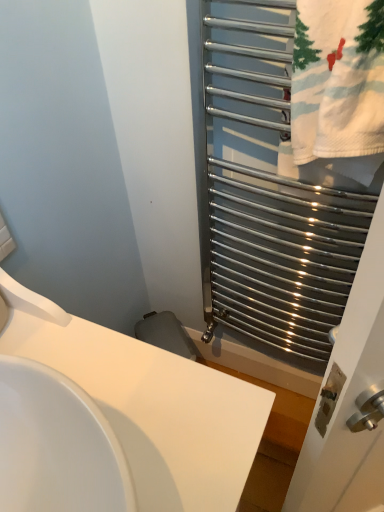
Question: Is polished metal towel rack at right outside white cotton towel at right?

Choices:
 (A) yes
 (B) no

Answer: (A)

Question: Does polished metal towel rack at right have a lesser width compared to white cotton towel at right?

Choices:
 (A) yes
 (B) no

Answer: (B)

Question: Can you confirm if polished metal towel rack at right is bigger than white cotton towel at right?

Choices:
 (A) no
 (B) yes

Answer: (B)

Question: Is polished metal towel rack at right touching white cotton towel at right?

Choices:
 (A) yes
 (B) no

Answer: (B)

Question: Is polished metal towel rack at right closer to camera compared to white cotton towel at right?

Choices:
 (A) yes
 (B) no

Answer: (A)

Question: From a real-world perspective, is polished metal towel rack at right positioned under white cotton towel at right based on gravity?

Choices:
 (A) no
 (B) yes

Answer: (B)

Question: From a real-world perspective, is white glossy sink at center positioned over polished metal towel rack at right based on gravity?

Choices:
 (A) no
 (B) yes

Answer: (A)

Question: Considering the relative sizes of white glossy sink at center and polished metal towel rack at right in the image provided, is white glossy sink at center smaller than polished metal towel rack at right?

Choices:
 (A) no
 (B) yes

Answer: (A)

Question: Does white glossy sink at center turn towards polished metal towel rack at right?

Choices:
 (A) no
 (B) yes

Answer: (A)

Question: Is white glossy sink at center placed right next to polished metal towel rack at right?

Choices:
 (A) no
 (B) yes

Answer: (A)

Question: Does white glossy sink at center have a lesser width compared to polished metal towel rack at right?

Choices:
 (A) yes
 (B) no

Answer: (B)

Question: Does white glossy sink at center have a lesser height compared to polished metal towel rack at right?

Choices:
 (A) yes
 (B) no

Answer: (A)

Question: Is polished metal towel rack at right thinner than white glossy sink at center?

Choices:
 (A) no
 (B) yes

Answer: (B)